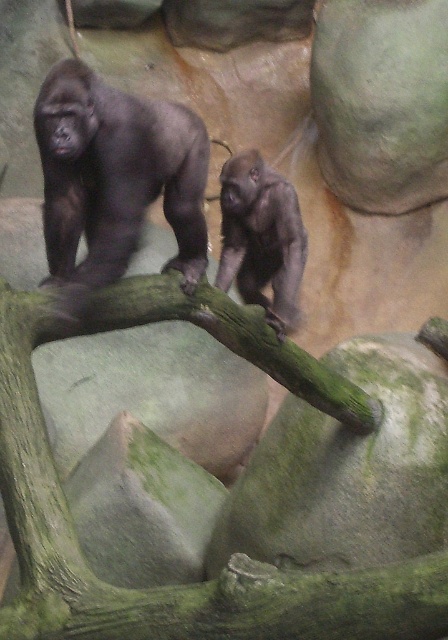
Is green rough branch at center below gray matte gorilla at center?

Correct, green rough branch at center is located below gray matte gorilla at center.

Does green rough branch at center have a smaller size compared to gray matte gorilla at center?

Incorrect, green rough branch at center is not smaller in size than gray matte gorilla at center.

What are the coordinates of `green rough branch at center` in the screenshot? It's located at (176, 586).

I want to click on green rough branch at center, so click(176, 586).

Is green rough branch at center further to camera compared to shiny dark gray gorilla at center?

No, green rough branch at center is in front of shiny dark gray gorilla at center.

How far apart are green rough branch at center and shiny dark gray gorilla at center?

green rough branch at center and shiny dark gray gorilla at center are 16.14 inches apart from each other.

This screenshot has height=640, width=448. I want to click on green rough branch at center, so click(x=176, y=586).

What are the coordinates of `green rough branch at center` in the screenshot? It's located at coord(176,586).

Is point (139, 179) less distant than point (215, 282)?

Yes.

Is point (47, 260) behind point (280, 307)?

No.

At what (x,y) coordinates should I click in order to perform the action: click on shiny dark gray gorilla at center. Please return your answer as a coordinate pair (x, y). Image resolution: width=448 pixels, height=640 pixels. Looking at the image, I should click on (116, 176).